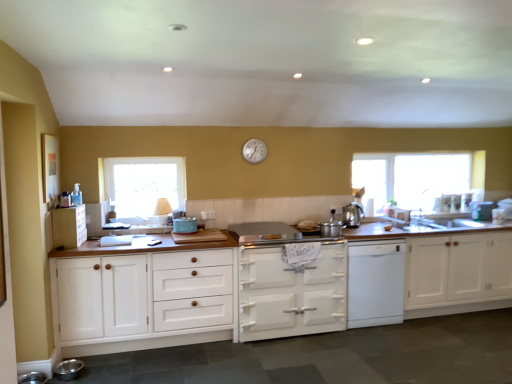
This screenshot has height=384, width=512. Identify the location of vacant area on the back side of metallic stainless steel bowl at lower left, which is counted as the first appliance, starting from the front. (89, 365).